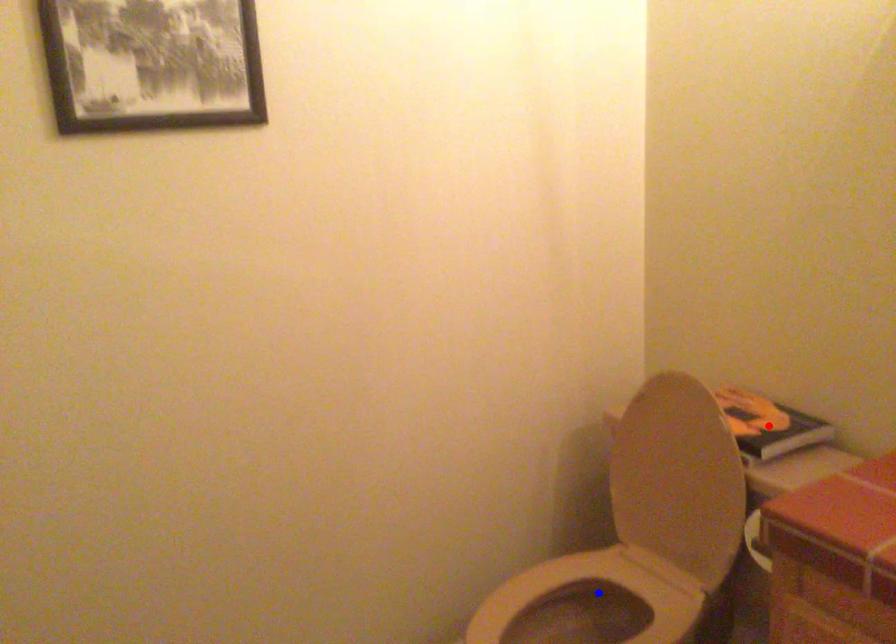
Question: Which of the two points in the image is closer to the camera?

Choices:
 (A) Blue point is closer.
 (B) Red point is closer.

Answer: (B)